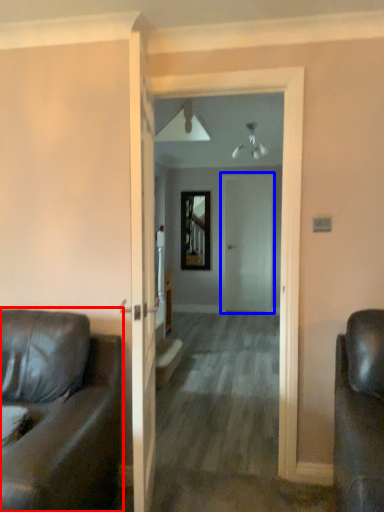
Question: Among these objects, which one is farthest to the camera, studio couch (highlighted by a red box) or door (highlighted by a blue box)?

Choices:
 (A) studio couch
 (B) door

Answer: (B)